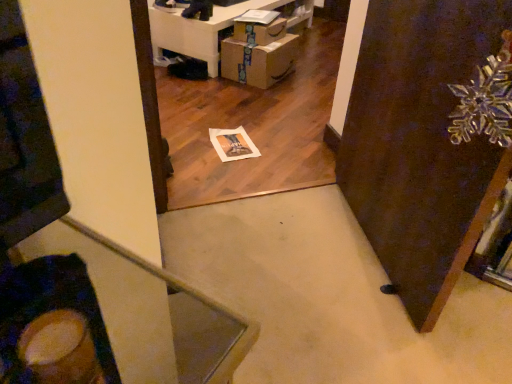
The height and width of the screenshot is (384, 512). What are the coordinates of `space that is in front of transparent glass snowflake at upper right` in the screenshot? It's located at (375, 326).